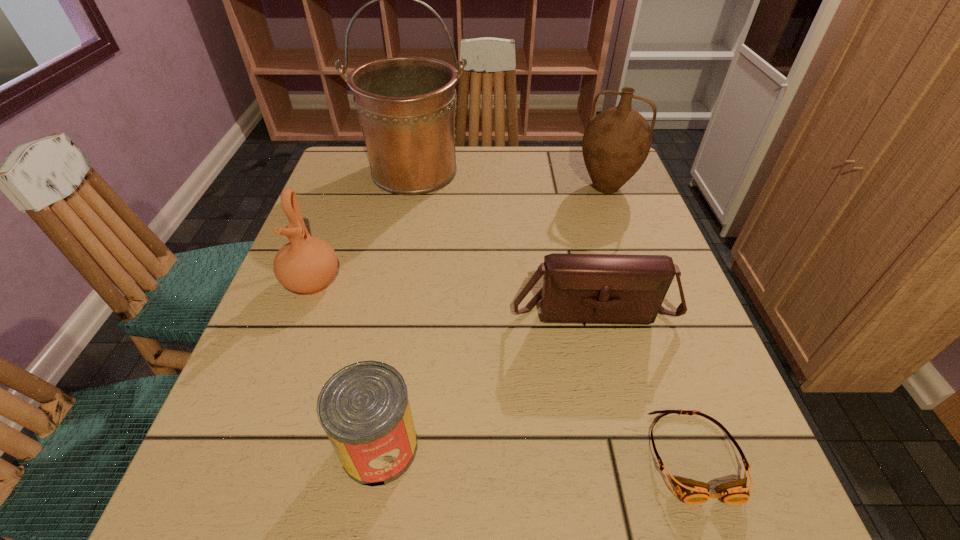
At what (x,y) coordinates should I click in order to perform the action: click on free spot located 0.270m on the right of the can. Please return your answer as a coordinate pair (x, y). Looking at the image, I should click on (599, 447).

Find the location of `bucket present at the far edge`. bucket present at the far edge is located at coordinates (406, 106).

I want to click on pitcher situated at the far edge, so click(616, 142).

This screenshot has height=540, width=960. I want to click on can located at the near edge, so click(364, 409).

This screenshot has width=960, height=540. I want to click on goggles at the near edge, so click(692, 492).

The width and height of the screenshot is (960, 540). I want to click on bucket at the left edge, so click(406, 106).

Find the location of a particular element. pottery located in the left edge section of the desktop is located at coordinates (306, 265).

Locate an element on the screen. pitcher that is at the right edge is located at coordinates (616, 142).

At what (x,y) coordinates should I click in order to perform the action: click on shoulder bag present at the right edge. Please return your answer as a coordinate pair (x, y). The height and width of the screenshot is (540, 960). Looking at the image, I should click on (577, 288).

Locate an element on the screen. goggles that is at the right edge is located at coordinates (692, 492).